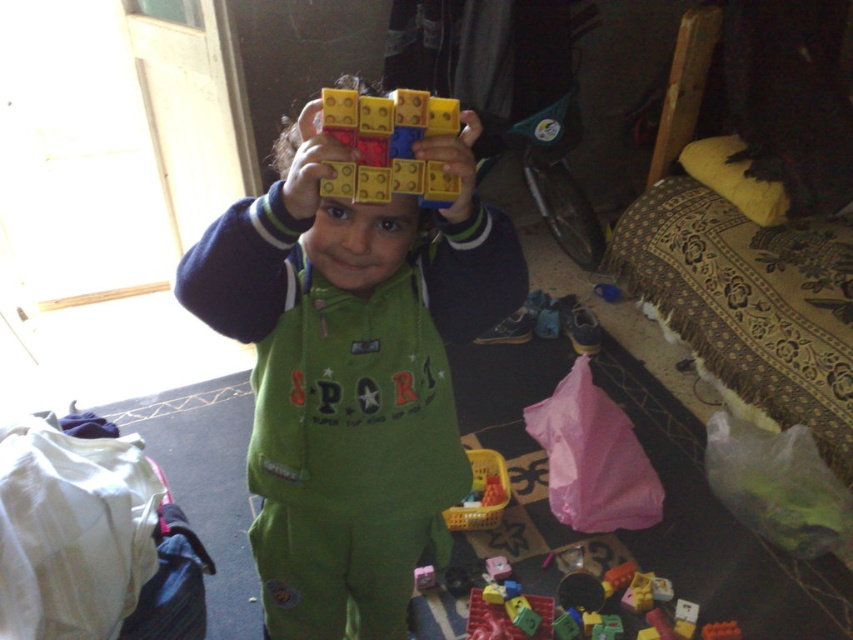
Does green matte jumpsuit at center appear under matte plastic blocks at center?

Yes, green matte jumpsuit at center is below matte plastic blocks at center.

Who is more distant from viewer, (x=316, y=257) or (x=351, y=168)?

Point (x=316, y=257)

I want to click on green matte jumpsuit at center, so click(350, 376).

Where is `green matte jumpsuit at center`? This screenshot has height=640, width=853. green matte jumpsuit at center is located at coordinates (350, 376).